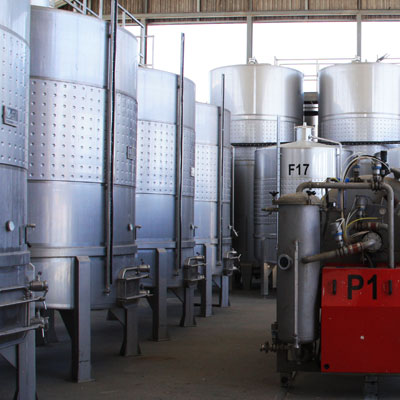
I want to click on floor, so click(176, 362).